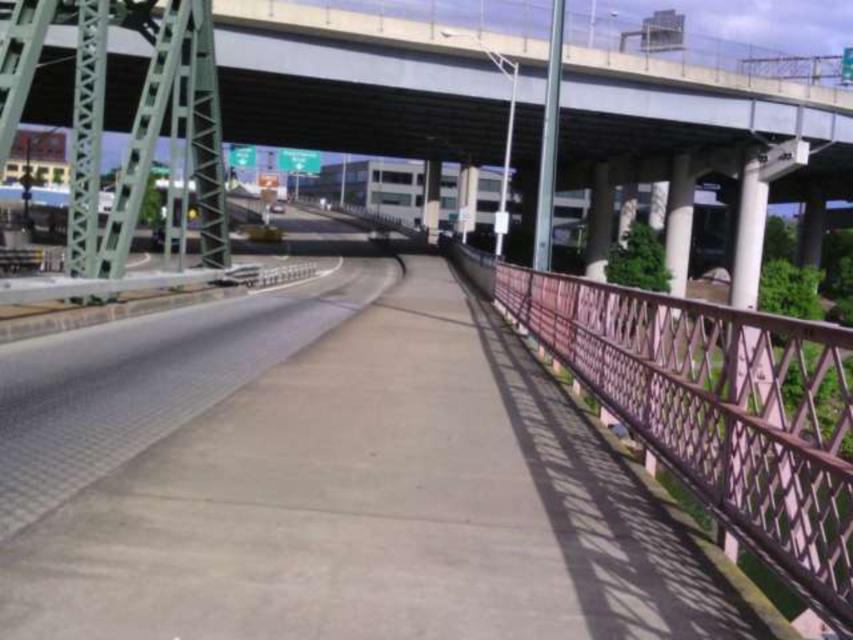
Question: Observing the image, what is the correct spatial positioning of concrete sidewalk at center in reference to pink metal railing at right?

Choices:
 (A) right
 (B) left

Answer: (B)

Question: Can you confirm if concrete sidewalk at center is positioned below pink metal railing at right?

Choices:
 (A) yes
 (B) no

Answer: (A)

Question: Is concrete bridge at upper center below pink metal railing at right?

Choices:
 (A) no
 (B) yes

Answer: (A)

Question: Which of the following is the closest to the observer?

Choices:
 (A) (497, 609)
 (B) (596, 48)
 (C) (780, 348)

Answer: (A)

Question: Among these points, which one is farthest from the camera?

Choices:
 (A) (379, 138)
 (B) (630, 566)

Answer: (A)

Question: Based on their relative distances, which object is nearer to the pink metal railing at right?

Choices:
 (A) concrete bridge at upper center
 (B) concrete sidewalk at center

Answer: (B)